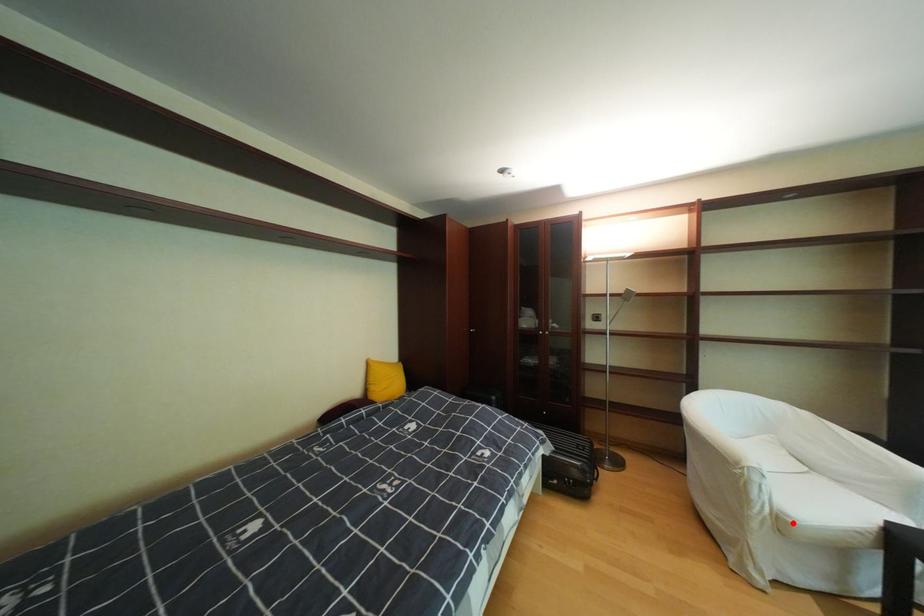
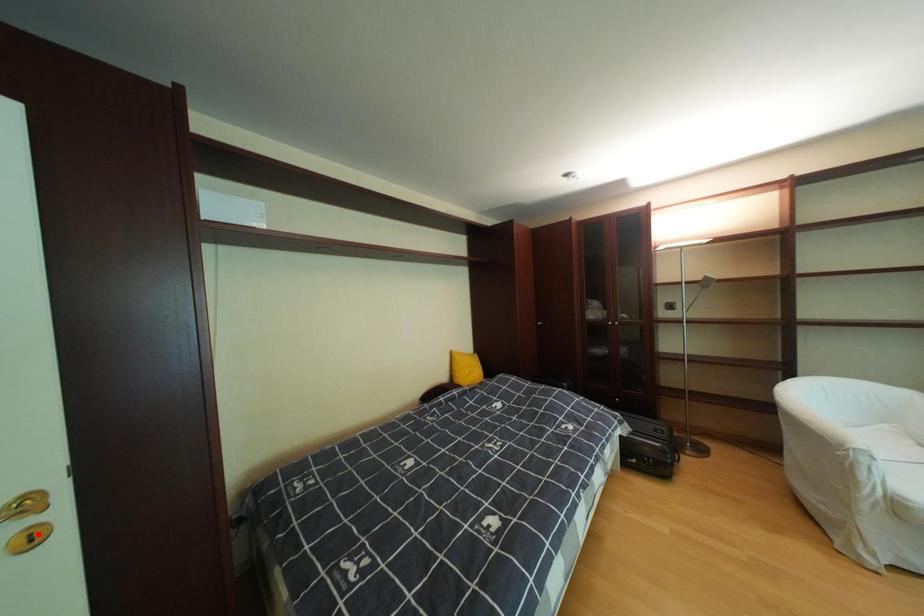
I am providing you with two images of the same scene from different viewpoints. A red point is marked on the first image and another point is marked on the second image. Are the points marked in image1 and image2 representing the same 3D position?

No